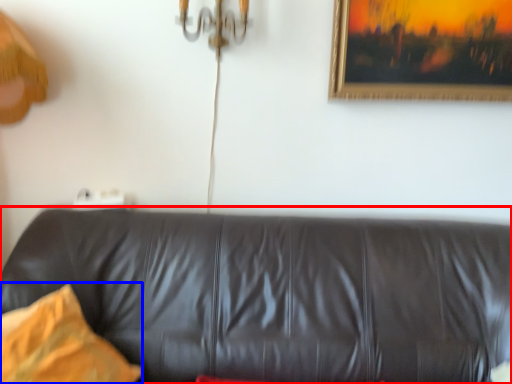
Question: Which of the following is the farthest to the observer, studio couch (highlighted by a red box) or pillow (highlighted by a blue box)?

Choices:
 (A) studio couch
 (B) pillow

Answer: (B)